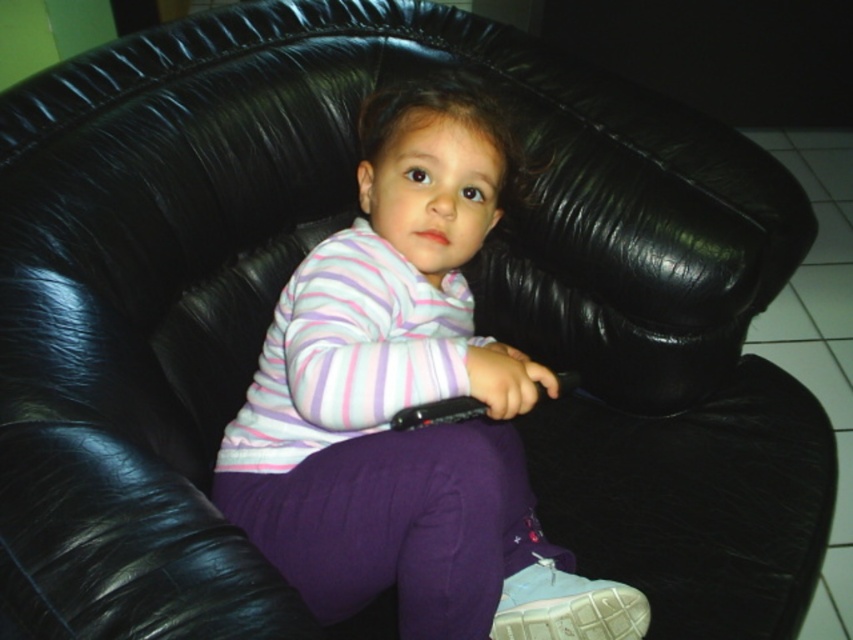
The child is wearing a striped cotton shirt at center and a light blue fabric shoe at lower center. Which clothing item is taller?

The striped cotton shirt at center is taller than the light blue fabric shoe at lower center.

You are a fashion designer observing a child wearing a striped cotton shirt at center and a light blue fabric shoe at lower center. Which clothing item is wider?

The striped cotton shirt at center is wider than the light blue fabric shoe at lower center.